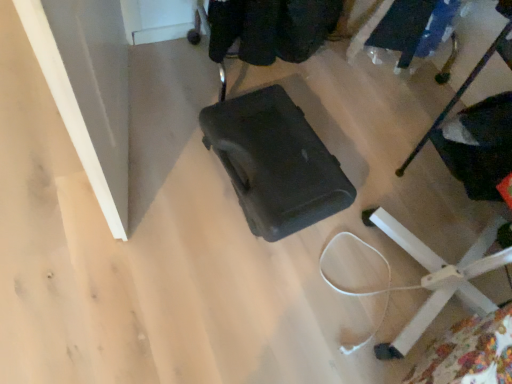
Locate an element on the screen. The width and height of the screenshot is (512, 384). free spot to the left of white plastic chair at lower right is located at coordinates (371, 153).